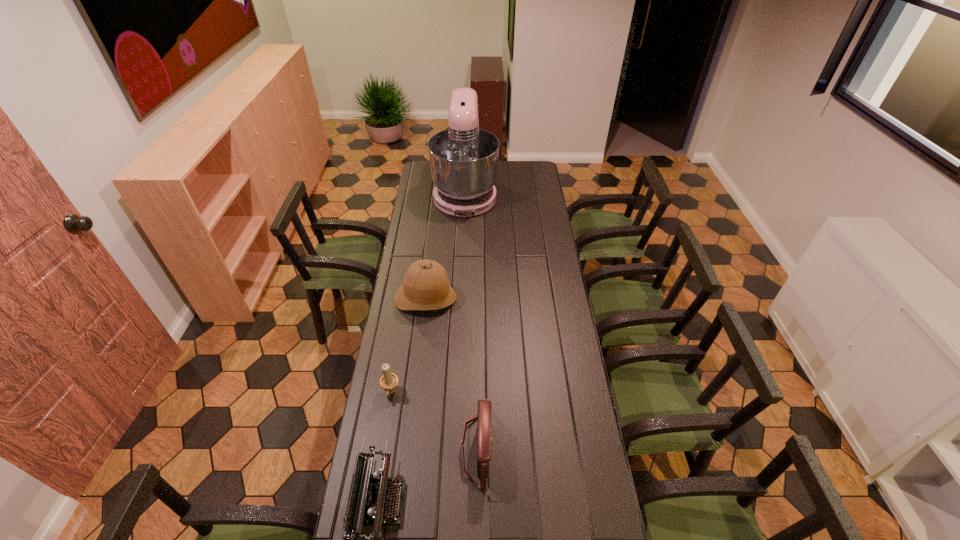
Image resolution: width=960 pixels, height=540 pixels. Find the location of `vacant area between the third farthest object and the second farthest object`. vacant area between the third farthest object and the second farthest object is located at coordinates pyautogui.click(x=408, y=346).

The height and width of the screenshot is (540, 960). Find the location of `vacant space in between the shoulder bag and the third farthest object`. vacant space in between the shoulder bag and the third farthest object is located at coordinates (434, 421).

The image size is (960, 540). Find the location of `free spot between the mixer and the shoulder bag`. free spot between the mixer and the shoulder bag is located at coordinates (470, 321).

Locate which object ranks second in proximity to the fourth shortest object. Please provide its 2D coordinates. Your answer should be formatted as a tuple, i.e. [(x, y)], where the tuple contains the x and y coordinates of a point satisfying the conditions above.

[(484, 440)]

This screenshot has height=540, width=960. I want to click on object that stands as the fourth closest to the typewriter, so pos(463,159).